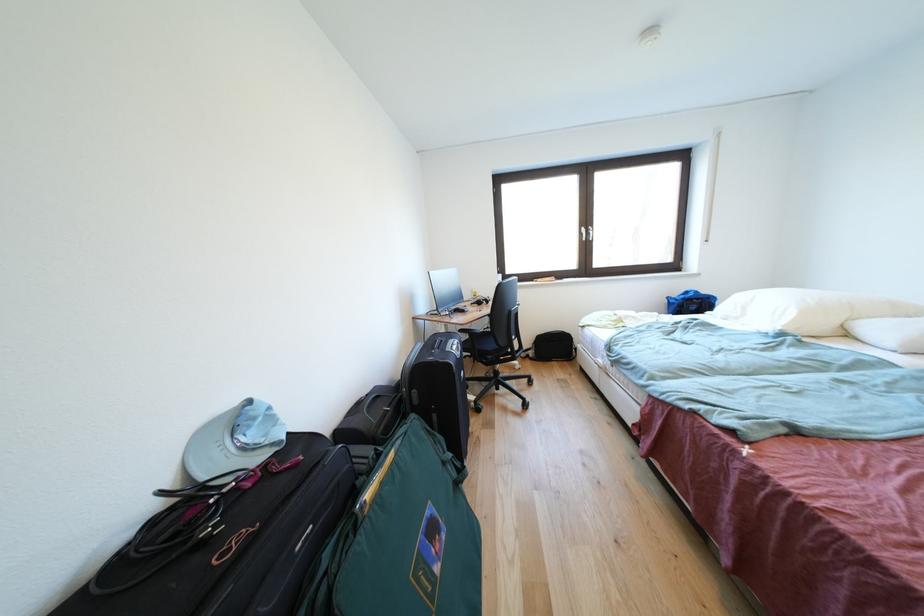
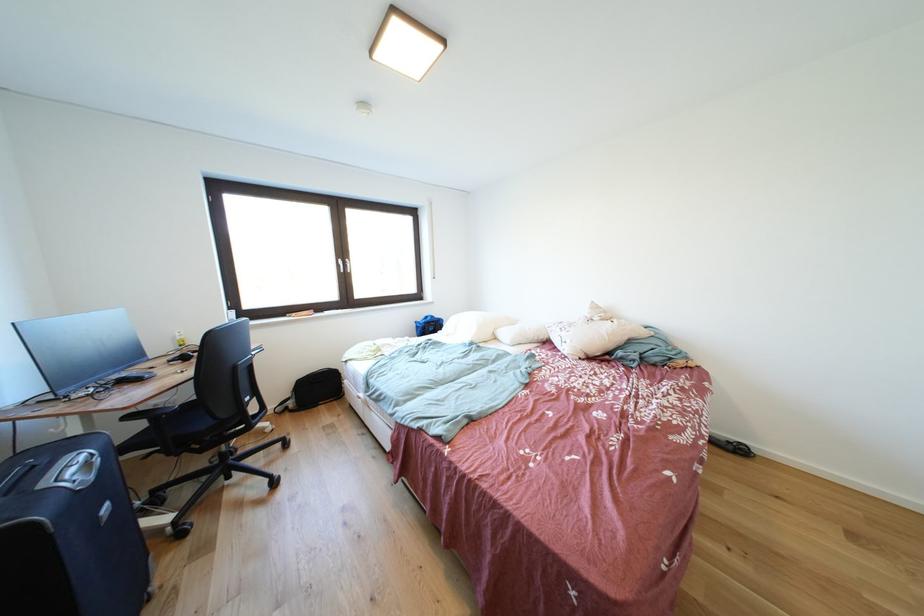
Find the pixel in the second image that matches pixel 591 233 in the first image.

(348, 265)